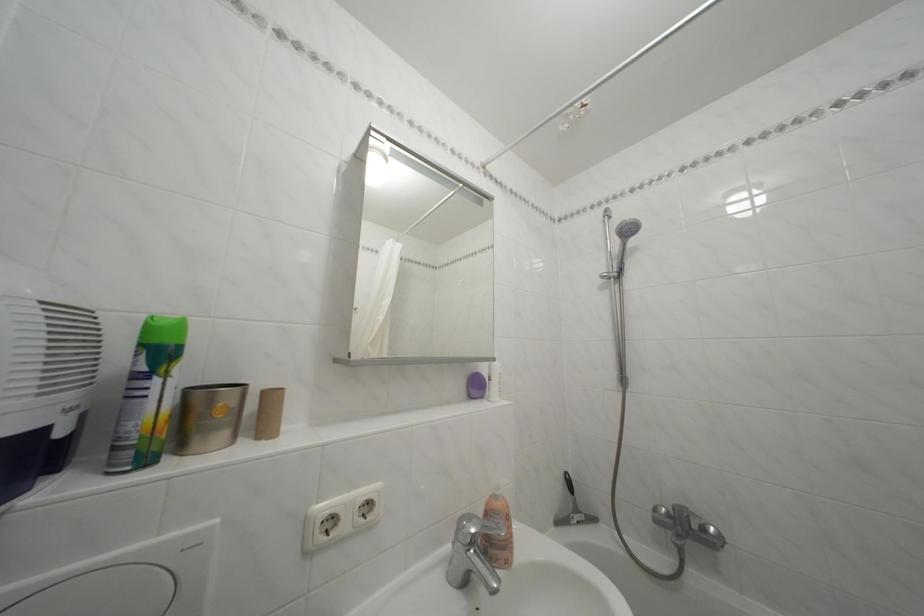
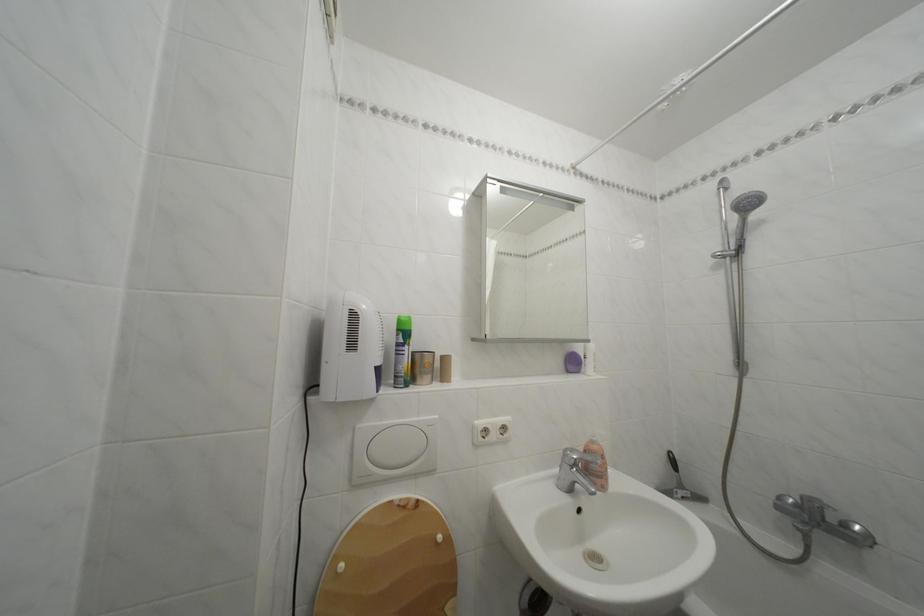
The point at (505, 504) is marked in the first image. Where is the corresponding point in the second image?

(602, 448)